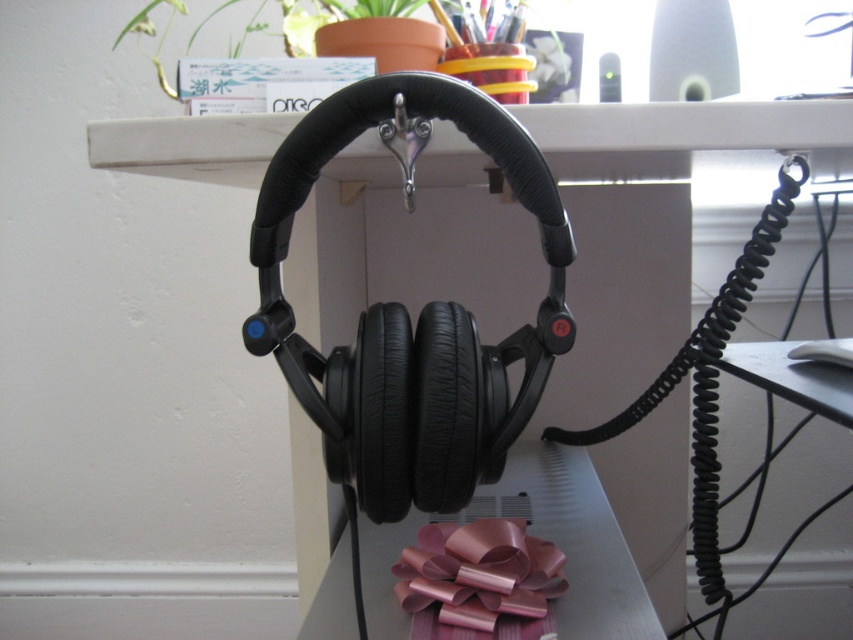
You are organizing a gift box and need to choose between the metallic pink bow at lower center and the pink shiny ribbon at lower center. Which one is wider?

The metallic pink bow at lower center is wider than the pink shiny ribbon at lower center.

You are organizing a gift wrapping station and need to arrange the metallic pink bow at lower center and the pink shiny ribbon at lower center on a shelf. Based on their current positions, which one should you move to the left to make space for a new roll of wrapping paper?

The metallic pink bow at lower center is to the right of the pink shiny ribbon at lower center. To make space for the new roll of wrapping paper, you should move the metallic pink bow at lower center to the left so it aligns with or shifts past the position of the pink shiny ribbon at lower center.

You are organizing a gift box and notice two decorations on the desk setup in the image. The decorations are the metallic pink bow at lower center and the pink shiny ribbon at lower center. Which decoration is closer to you when looking at the desk setup?

The metallic pink bow at lower center is closer to you because it is in front of the pink shiny ribbon at lower center.